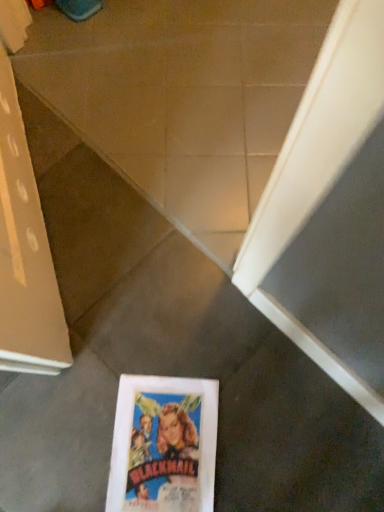
Question: Can we say white glossy concrete at center lies outside multicolored paper at center?

Choices:
 (A) no
 (B) yes

Answer: (B)

Question: Is white glossy concrete at center not close to multicolored paper at center?

Choices:
 (A) yes
 (B) no

Answer: (B)

Question: Considering the relative sizes of white glossy concrete at center and multicolored paper at center in the image provided, is white glossy concrete at center taller than multicolored paper at center?

Choices:
 (A) yes
 (B) no

Answer: (A)

Question: Are white glossy concrete at center and multicolored paper at center making contact?

Choices:
 (A) yes
 (B) no

Answer: (B)

Question: Is white glossy concrete at center smaller than multicolored paper at center?

Choices:
 (A) yes
 (B) no

Answer: (B)

Question: Considering the relative sizes of white glossy concrete at center and multicolored paper at center in the image provided, is white glossy concrete at center bigger than multicolored paper at center?

Choices:
 (A) yes
 (B) no

Answer: (A)

Question: Can you confirm if multicolored paper at center is wider than white glossy concrete at center?

Choices:
 (A) yes
 (B) no

Answer: (B)

Question: Does multicolored paper at center have a smaller size compared to white glossy concrete at center?

Choices:
 (A) no
 (B) yes

Answer: (B)

Question: Is multicolored paper at center oriented away from white glossy concrete at center?

Choices:
 (A) no
 (B) yes

Answer: (A)

Question: Is multicolored paper at center taller than white glossy concrete at center?

Choices:
 (A) yes
 (B) no

Answer: (B)

Question: Does multicolored paper at center appear on the right side of white glossy concrete at center?

Choices:
 (A) yes
 (B) no

Answer: (B)

Question: Is multicolored paper at center not inside white glossy concrete at center?

Choices:
 (A) yes
 (B) no

Answer: (A)

Question: Is white glossy concrete at center inside the boundaries of multicolored paper at center, or outside?

Choices:
 (A) inside
 (B) outside

Answer: (B)